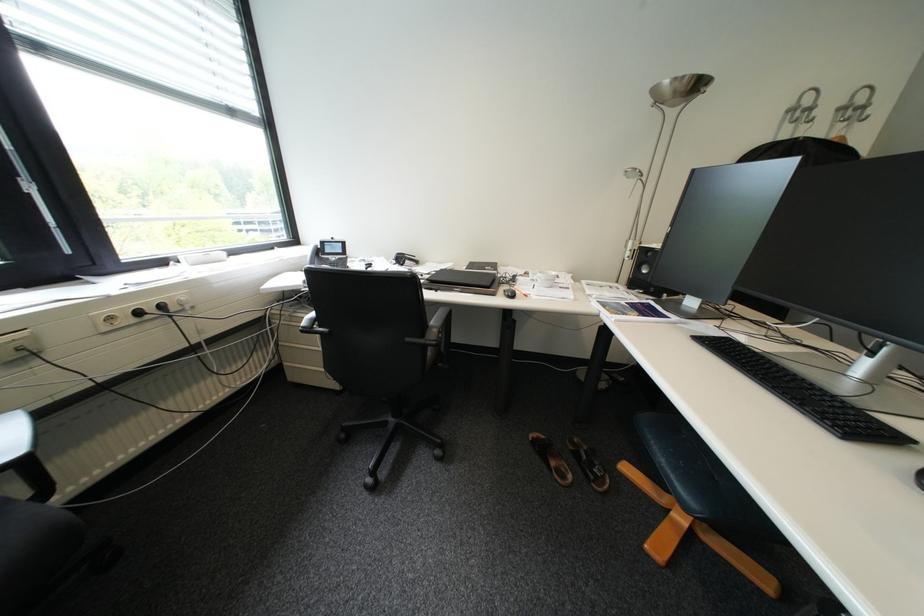
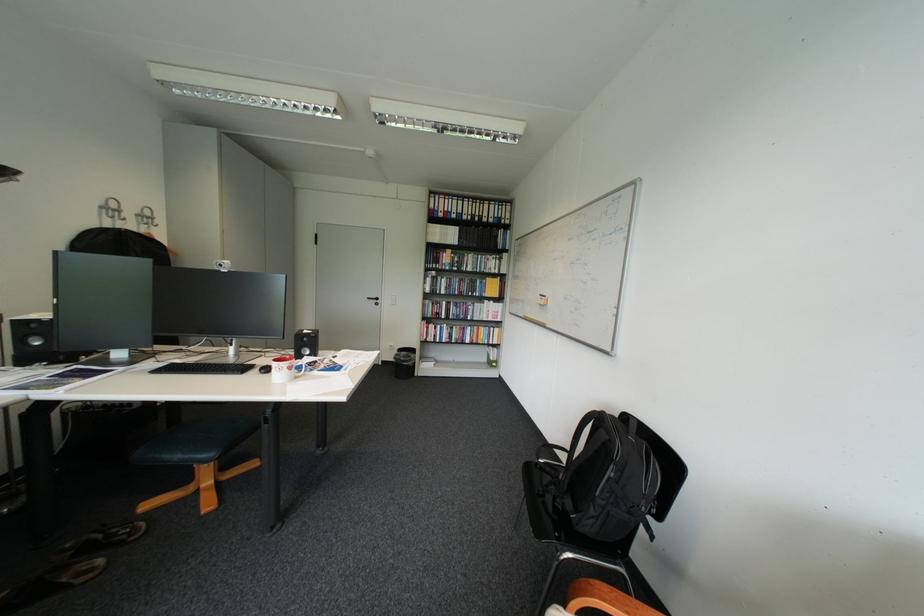
The point at (664,443) is marked in the first image. Where is the corresponding point in the second image?

(176, 456)